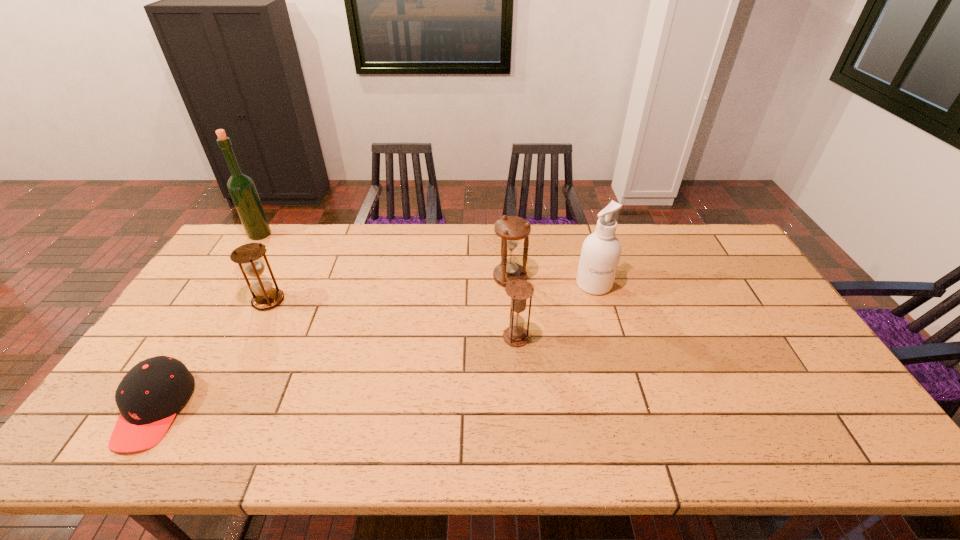
The image size is (960, 540). Find the location of `vacant region located on the front of the tallest object`. vacant region located on the front of the tallest object is located at coordinates (250, 249).

You are a GUI agent. You are given a task and a screenshot of the screen. Output one action in this format:
    pyautogui.click(x=<x>, y=<y>)
    Task: Click on the vacant region located on the front label of the second tallest object
    
    Given the screenshot: What is the action you would take?
    pyautogui.click(x=609, y=335)

This screenshot has width=960, height=540. What are the coordinates of `vacant space situated on the front of the farthest hourglass` in the screenshot? It's located at (515, 337).

This screenshot has width=960, height=540. Find the location of `free location located 0.370m on the front of the fourth object from right to left`. free location located 0.370m on the front of the fourth object from right to left is located at coordinates click(x=204, y=423).

What are the coordinates of `vacant point located on the back of the nearest hourglass` in the screenshot? It's located at (513, 292).

Where is `object that is at the far edge`? This screenshot has width=960, height=540. object that is at the far edge is located at coordinates (241, 187).

The height and width of the screenshot is (540, 960). Find the location of `object that is at the near edge`. object that is at the near edge is located at coordinates (149, 396).

Locate an element on the screen. The image size is (960, 540). liquor that is at the left edge is located at coordinates (241, 187).

At what (x,y) coordinates should I click in order to perform the action: click on cap present at the left edge. Please return your answer as a coordinate pair (x, y). The height and width of the screenshot is (540, 960). Looking at the image, I should click on (149, 396).

Find the location of `object that is at the far left corner`. object that is at the far left corner is located at coordinates (241, 187).